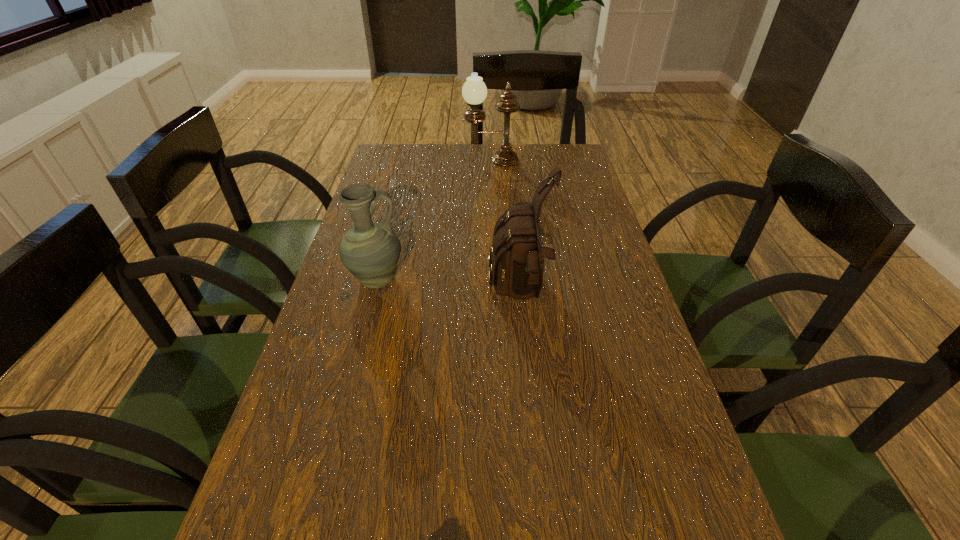
Where is `free spot that satisfies the following two spatial constraints: 1. on the front side of the oil lamp; 2. on the handle side of the leftmost object`? The height and width of the screenshot is (540, 960). free spot that satisfies the following two spatial constraints: 1. on the front side of the oil lamp; 2. on the handle side of the leftmost object is located at coordinates (496, 280).